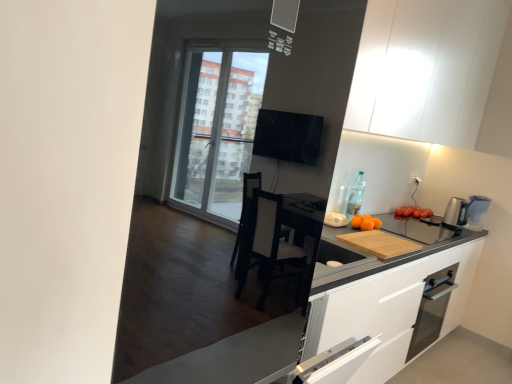
Question: Is point (463, 49) positioned closer to the camera than point (367, 226)?

Choices:
 (A) farther
 (B) closer

Answer: (A)

Question: Is white matte cabinet at upper center in front of or behind orange matte at right in the image?

Choices:
 (A) front
 (B) behind

Answer: (A)

Question: Estimate the real-world distances between objects in this image. Which object is farther from the glass door oven at lower right?

Choices:
 (A) silver metallic coffee machine at right
 (B) wooden cutting board at right
 (C) clear glass bottle at upper right
 (D) white matte cabinet at upper center
 (E) orange matte at right

Answer: (D)

Question: Based on their relative distances, which object is nearer to the orange matte at right?

Choices:
 (A) wooden cutting board at right
 (B) white matte cabinet at upper center
 (C) glass door oven at lower right
 (D) clear glass bottle at upper right
 (E) silver metallic coffee machine at right

Answer: (D)